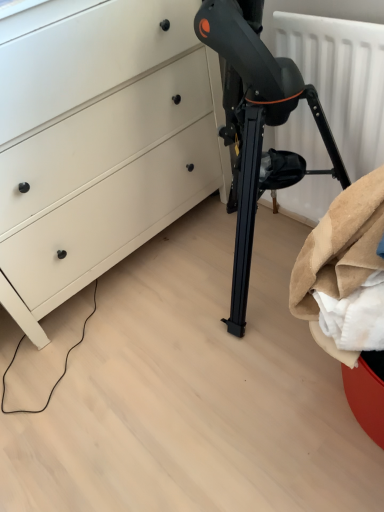
Question: From a real-world perspective, is white matte chest of drawers at lower left below white matte radiator at upper right?

Choices:
 (A) no
 (B) yes

Answer: (A)

Question: Can you confirm if white matte chest of drawers at lower left is smaller than white matte radiator at upper right?

Choices:
 (A) yes
 (B) no

Answer: (B)

Question: Is white matte chest of drawers at lower left positioned with its back to white matte radiator at upper right?

Choices:
 (A) no
 (B) yes

Answer: (A)

Question: From the image's perspective, is white matte chest of drawers at lower left located beneath white matte radiator at upper right?

Choices:
 (A) no
 (B) yes

Answer: (A)

Question: Can you confirm if white matte chest of drawers at lower left is wider than white matte radiator at upper right?

Choices:
 (A) yes
 (B) no

Answer: (A)

Question: Is white matte chest of drawers at lower left not inside white matte radiator at upper right?

Choices:
 (A) no
 (B) yes

Answer: (B)

Question: Is white matte radiator at upper right closer to camera compared to white matte chest of drawers at lower left?

Choices:
 (A) no
 (B) yes

Answer: (A)

Question: Is white matte radiator at upper right facing towards white matte chest of drawers at lower left?

Choices:
 (A) yes
 (B) no

Answer: (B)

Question: Is white matte radiator at upper right not inside white matte chest of drawers at lower left?

Choices:
 (A) no
 (B) yes

Answer: (B)

Question: From the image's perspective, is white matte radiator at upper right located above white matte chest of drawers at lower left?

Choices:
 (A) no
 (B) yes

Answer: (A)

Question: Considering the relative positions of white matte radiator at upper right and white matte chest of drawers at lower left in the image provided, is white matte radiator at upper right to the left of white matte chest of drawers at lower left from the viewer's perspective?

Choices:
 (A) no
 (B) yes

Answer: (A)

Question: Can you confirm if white matte radiator at upper right is wider than white matte chest of drawers at lower left?

Choices:
 (A) yes
 (B) no

Answer: (B)

Question: Is white matte radiator at upper right spatially inside white matte chest of drawers at lower left, or outside of it?

Choices:
 (A) inside
 (B) outside

Answer: (B)